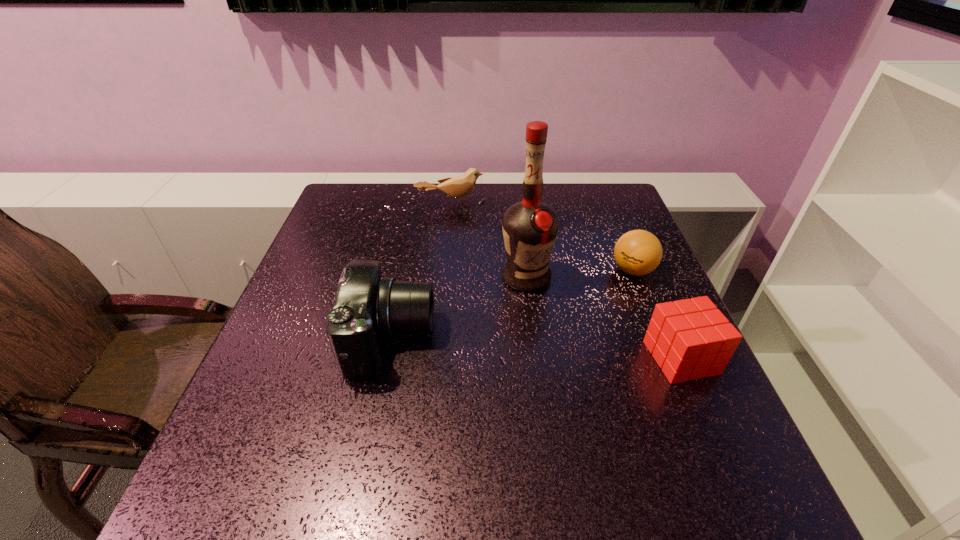
The image size is (960, 540). I want to click on free spot on the desktop that is between the camera and the cube and is positioned on the side with brand of the ping-pong ball, so click(x=495, y=346).

I want to click on free spot on the desktop that is between the camera and the cube and is positioned at the beak of the farthest object, so click(505, 346).

Where is `vacant space on the desktop that is between the fourth shortest object and the cube and is positioned on the front and back of the tallest object`? The height and width of the screenshot is (540, 960). vacant space on the desktop that is between the fourth shortest object and the cube and is positioned on the front and back of the tallest object is located at coordinates (540, 348).